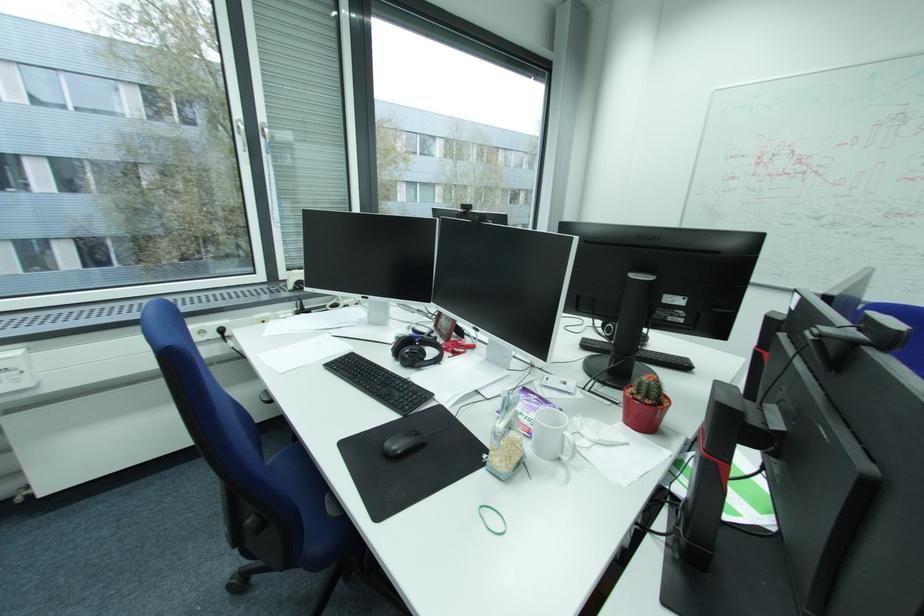
Where is `white window handle`? white window handle is located at coordinates (244, 126).